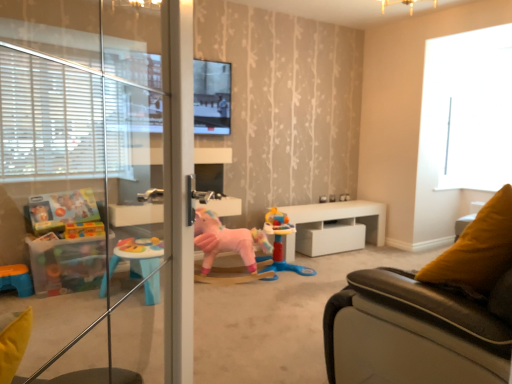
Question: Would you consider transparent glass window at upper right to be distant from transparent glass screen door at left?

Choices:
 (A) no
 (B) yes

Answer: (B)

Question: Can you confirm if transparent glass window at upper right is smaller than transparent glass screen door at left?

Choices:
 (A) no
 (B) yes

Answer: (B)

Question: From the image's perspective, is transparent glass window at upper right beneath transparent glass screen door at left?

Choices:
 (A) no
 (B) yes

Answer: (A)

Question: Is transparent glass window at upper right positioned with its back to transparent glass screen door at left?

Choices:
 (A) yes
 (B) no

Answer: (B)

Question: Does transparent glass window at upper right have a lesser height compared to transparent glass screen door at left?

Choices:
 (A) no
 (B) yes

Answer: (A)

Question: Considering the relative sizes of transparent glass window at upper right and transparent glass screen door at left in the image provided, is transparent glass window at upper right taller than transparent glass screen door at left?

Choices:
 (A) yes
 (B) no

Answer: (A)

Question: Does transparent glass screen door at left have a lesser width compared to transparent glass window at upper right?

Choices:
 (A) no
 (B) yes

Answer: (A)

Question: Is transparent glass screen door at left shorter than transparent glass window at upper right?

Choices:
 (A) yes
 (B) no

Answer: (A)

Question: Is transparent glass screen door at left not close to transparent glass window at upper right?

Choices:
 (A) yes
 (B) no

Answer: (A)

Question: Is transparent glass screen door at left next to transparent glass window at upper right?

Choices:
 (A) no
 (B) yes

Answer: (A)

Question: Is transparent glass screen door at left bigger than transparent glass window at upper right?

Choices:
 (A) yes
 (B) no

Answer: (A)

Question: Is transparent glass screen door at left to the left of transparent glass window at upper right from the viewer's perspective?

Choices:
 (A) yes
 (B) no

Answer: (A)

Question: From the image's perspective, is rubberized plastic playset at center, the first toy in the right-to-left sequence, located beneath white glossy table at center?

Choices:
 (A) no
 (B) yes

Answer: (B)